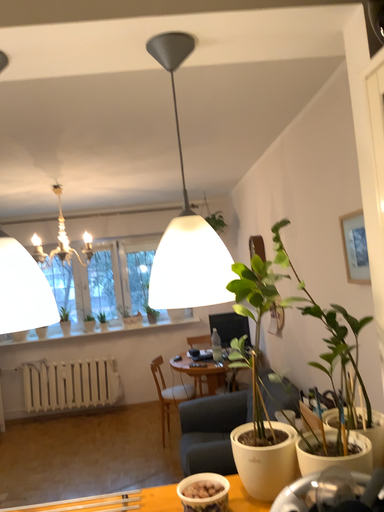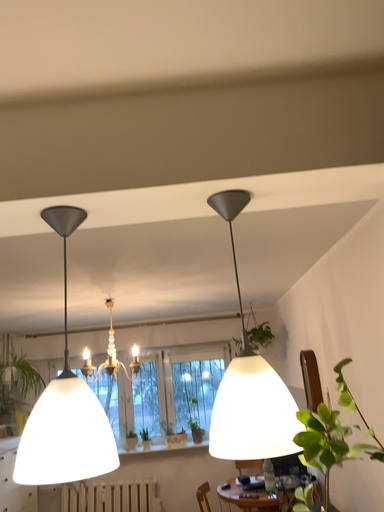
Question: Which way did the camera rotate in the video?

Choices:
 (A) rotated upward
 (B) rotated downward

Answer: (A)